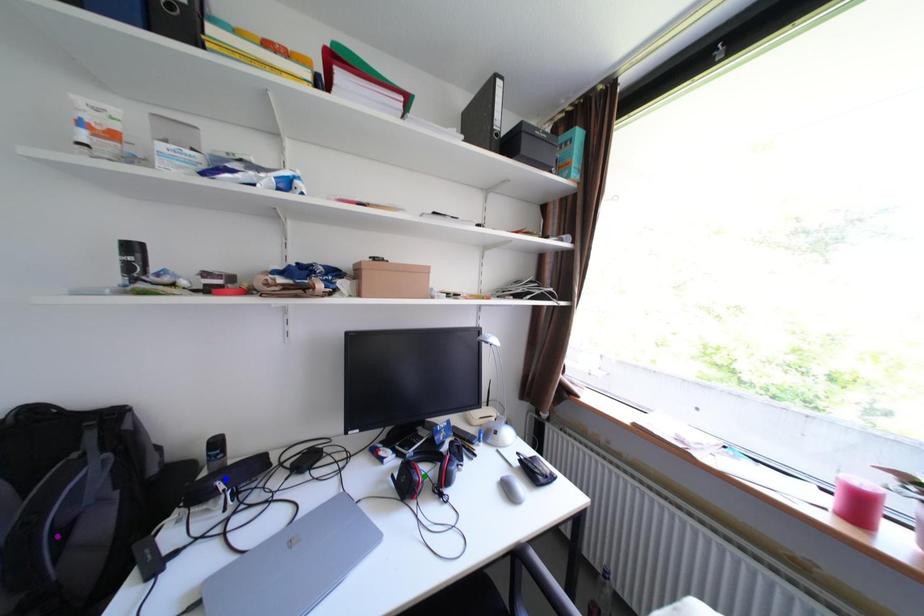
Looking at this image, order these from nearest to farthest:
A) purple point
B) blue point
C) green point

green point
blue point
purple point